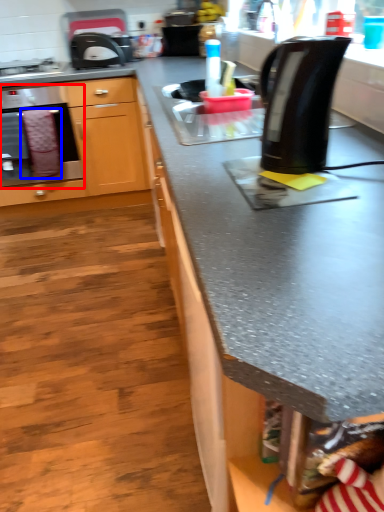
Question: Among these objects, which one is nearest to the camera, oven (highlighted by a red box) or blanket (highlighted by a blue box)?

Choices:
 (A) oven
 (B) blanket

Answer: (A)